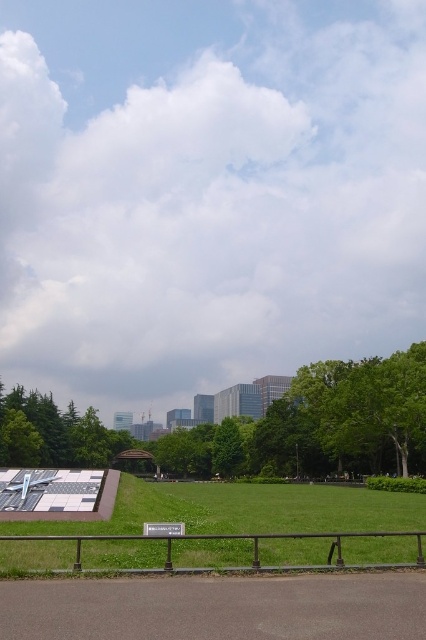
Does point (176, 508) come closer to viewer compared to point (218, 440)?

Yes.

Between point (0, 556) and point (238, 432), which one is positioned behind?

The point (238, 432) is more distant.

Does point (120, 493) come behind point (235, 451)?

No, (120, 493) is closer to viewer.

Locate an element on the screen. green grass at center is located at coordinates (250, 515).